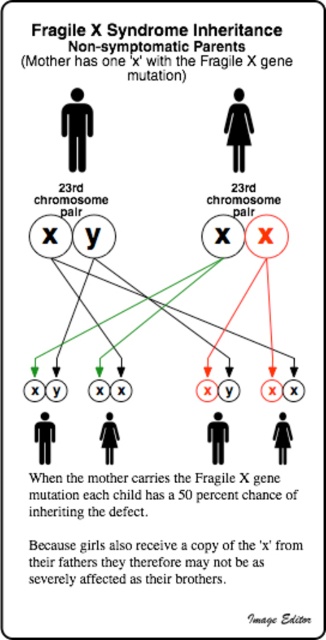
Question: Among these objects, which one is farthest from the camera?

Choices:
 (A) matte black figure at center
 (B) black solid figure at center
 (C) matte black woman at center
 (D) matte black woman at lower right

Answer: (C)

Question: In this image, where is black solid figure at center located relative to matte black figure at lower left?

Choices:
 (A) below
 (B) above

Answer: (B)

Question: Can you confirm if black solid figure at center is thinner than matte black figure at center?

Choices:
 (A) yes
 (B) no

Answer: (B)

Question: Which point is farther from the camera taking this photo?

Choices:
 (A) (224, 436)
 (B) (281, 449)

Answer: (A)

Question: Is black solid figure at center closer to the viewer compared to black figure at center?

Choices:
 (A) yes
 (B) no

Answer: (B)

Question: Estimate the real-world distances between objects in this image. Which object is farther from the matte black figure at lower left?

Choices:
 (A) black solid figure at center
 (B) matte black woman at lower right
 (C) black figure at center
 (D) matte black figure at center

Answer: (C)